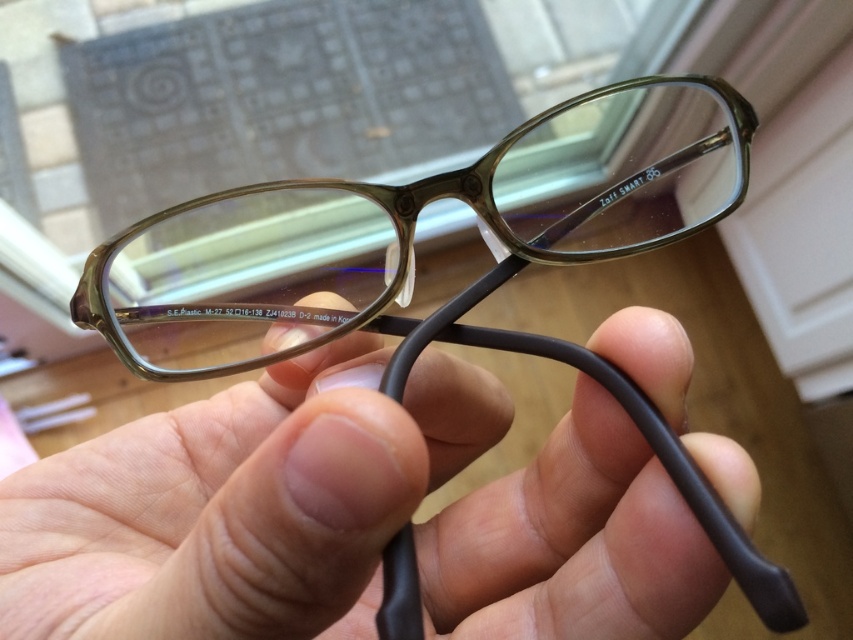
Can you confirm if matte black glasses at center is positioned below translucent plastic glasses at center?

Yes.

I want to click on matte black glasses at center, so click(241, 502).